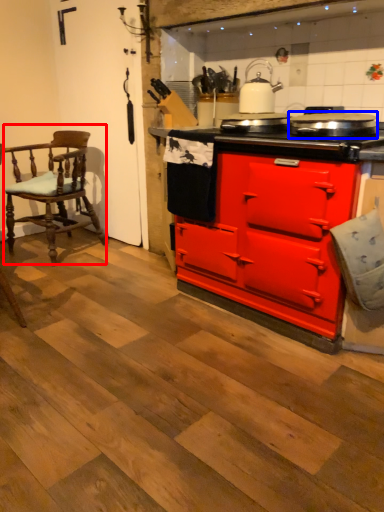
Question: Which object appears closest to the camera in this image, chair (highlighted by a red box) or appliance (highlighted by a blue box)?

Choices:
 (A) chair
 (B) appliance

Answer: (B)